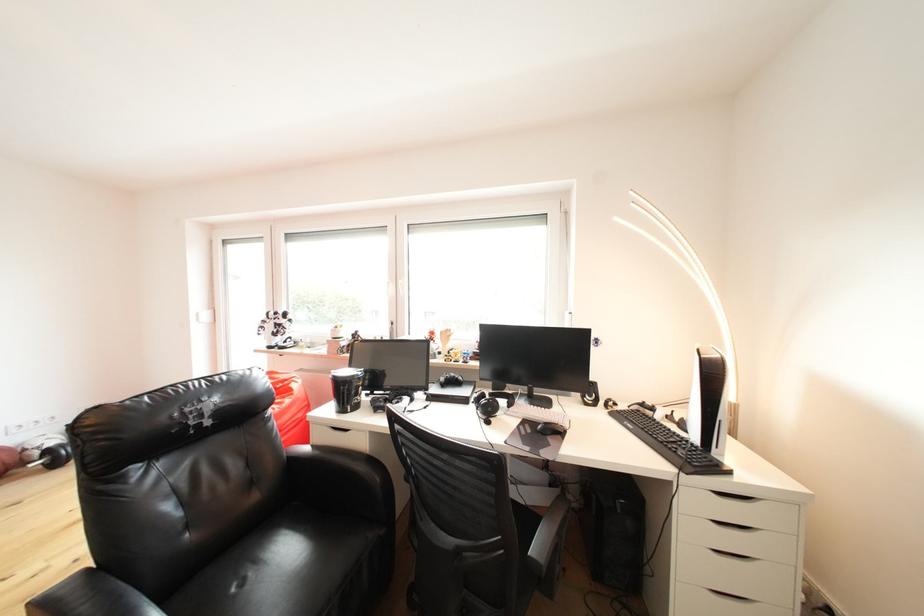
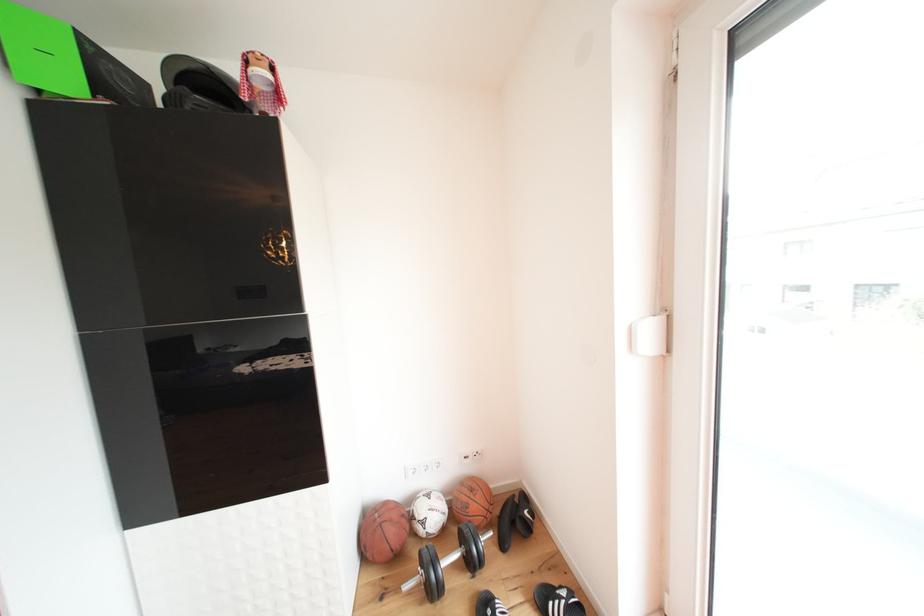
Where in the second image is the point corresponding to (32,455) from the first image?

(420, 523)